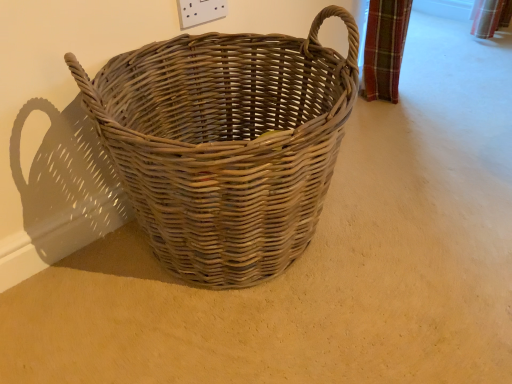
Identify the location of unoccupied region to the right of natural wicker basket at center. The width and height of the screenshot is (512, 384). (421, 145).